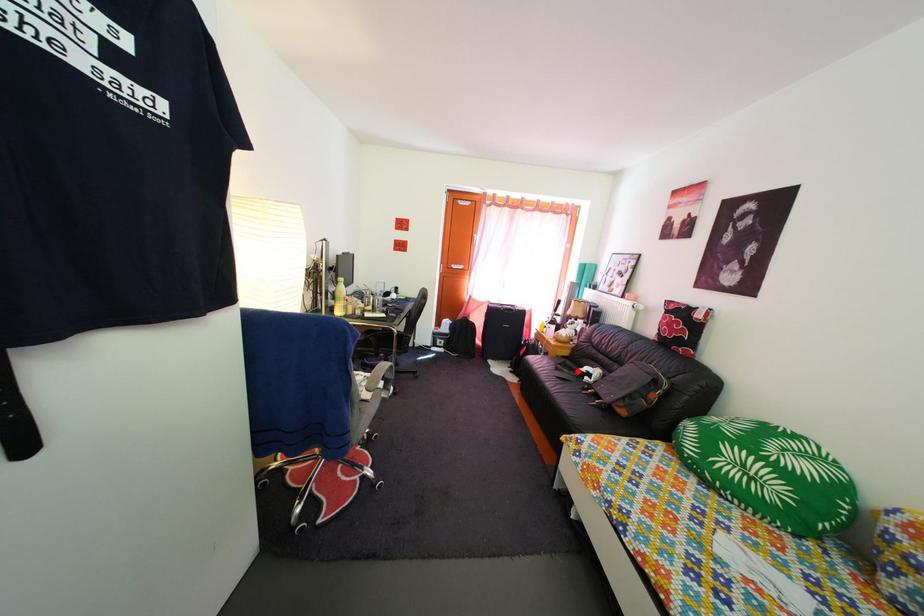
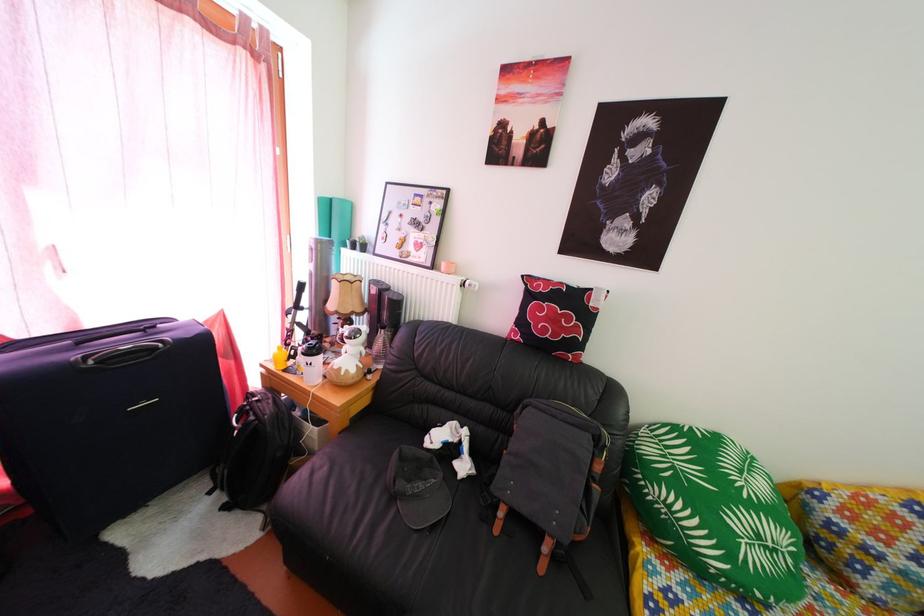
In the second image, find the point that corresponds to the highlighted location in the first image.

(419, 458)